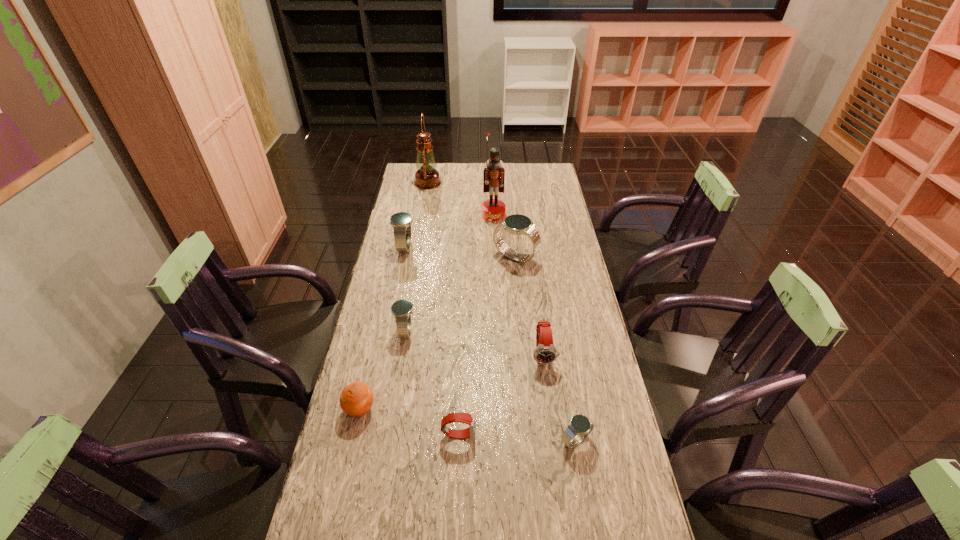
Locate an element on the screen. red nutcracker is located at coordinates (492, 209).

Where is `the eighth nearest object`? This screenshot has height=540, width=960. the eighth nearest object is located at coordinates (492, 209).

At what (x,y) coordinates should I click in order to perform the action: click on oil lamp. Please return your answer as a coordinate pair (x, y). Image resolution: width=960 pixels, height=540 pixels. Looking at the image, I should click on (427, 177).

The height and width of the screenshot is (540, 960). In order to click on the biggest blue watch in this screenshot , I will do `click(517, 224)`.

Locate an element on the screen. This screenshot has width=960, height=540. the tallest watch is located at coordinates (517, 224).

Where is `the third smallest blue watch`? Image resolution: width=960 pixels, height=540 pixels. the third smallest blue watch is located at coordinates (401, 222).

The width and height of the screenshot is (960, 540). Identify the location of the right red watch. (545, 352).

Where is `the farther red watch`? the farther red watch is located at coordinates (545, 352).

Locate an element on the screen. The image size is (960, 540). the second nearest blue watch is located at coordinates (402, 309).

At what (x,y) coordinates should I click in order to perform the action: click on orange. Please return your answer as a coordinate pair (x, y). The width and height of the screenshot is (960, 540). Looking at the image, I should click on (356, 399).